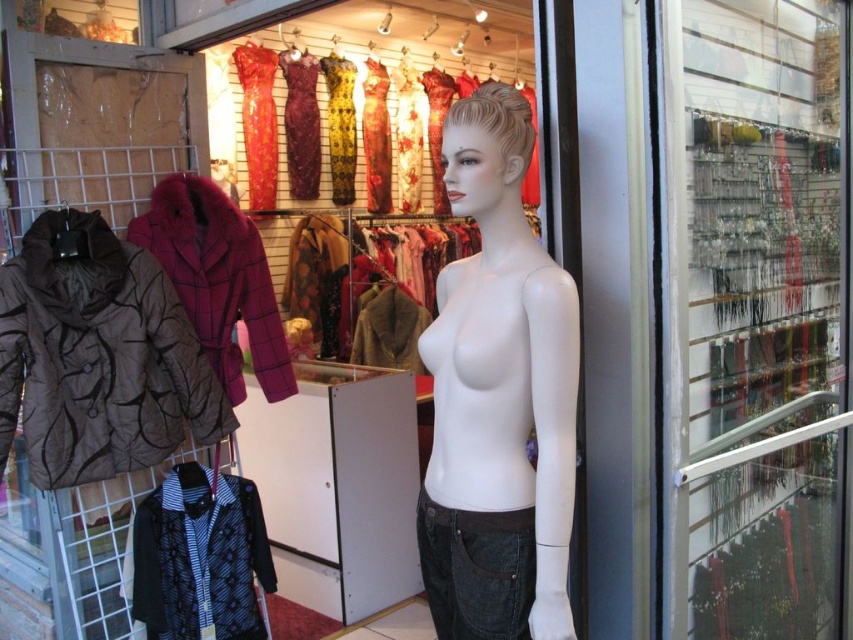
Question: Which object is farther from the camera taking this photo?

Choices:
 (A) brown textured coat at center
 (B) matte floral dress at center
 (C) patterned fabric jacket at lower left

Answer: (B)

Question: Does patterned fabric jacket at lower left have a greater width compared to shiny orange dress at upper center?

Choices:
 (A) yes
 (B) no

Answer: (A)

Question: Which object is positioned closest to the matte floral dress at center?

Choices:
 (A) shiny floral dress at center
 (B) brown quilted jacket at left

Answer: (A)

Question: Which point appears farthest from the camera in this image?

Choices:
 (A) (775, 204)
 (B) (67, 342)
 (C) (352, 342)

Answer: (C)

Question: Is brown textured coat at center above yellow patterned fabric dress at center?

Choices:
 (A) yes
 (B) no

Answer: (B)

Question: Is patterned fabric jacket at lower left above shiny floral dress at center?

Choices:
 (A) yes
 (B) no

Answer: (B)